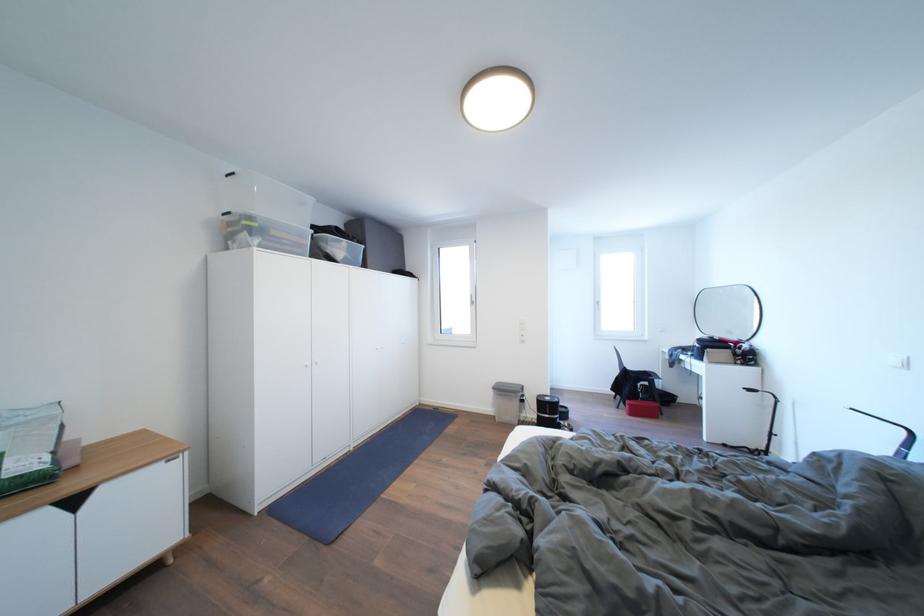
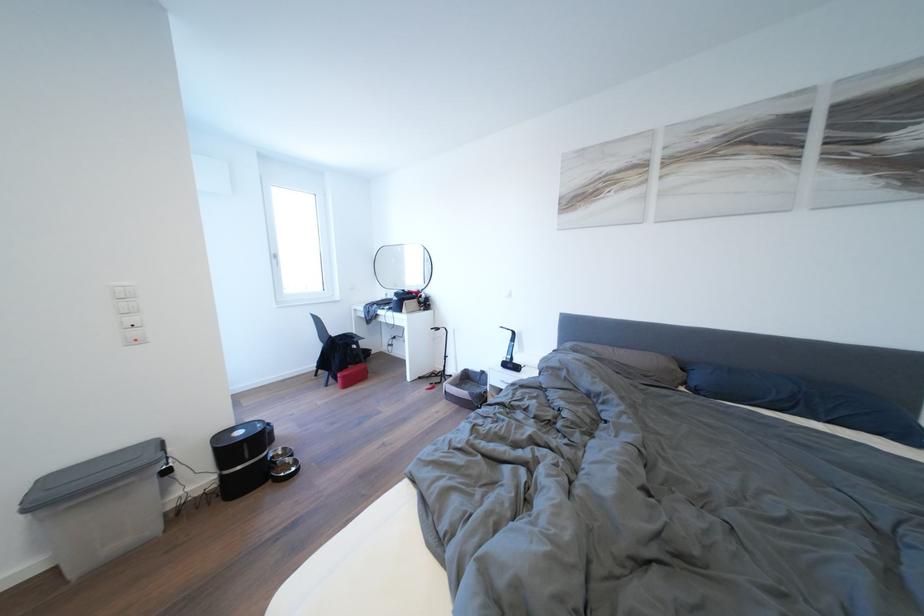
Find the pixel in the second image that matches (605,308) in the first image.

(284, 261)